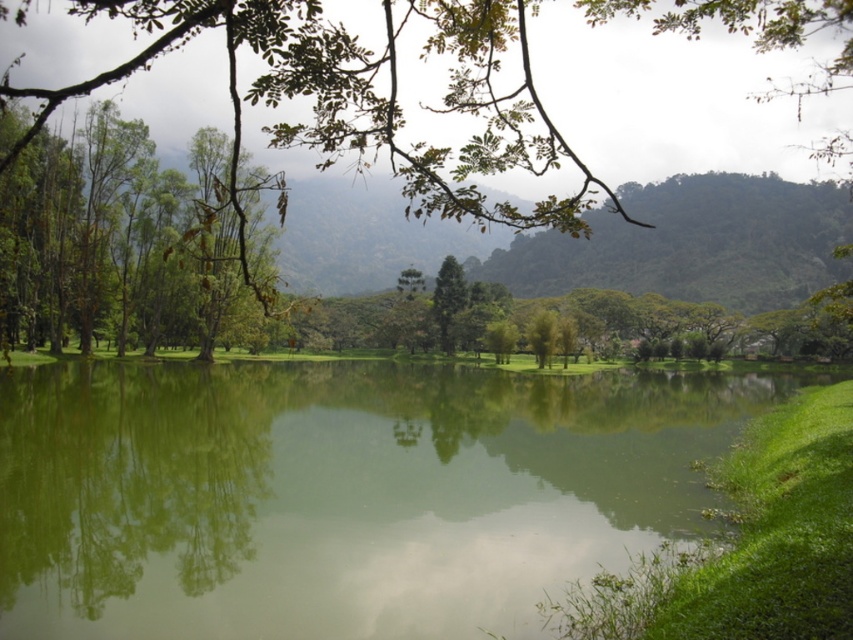
Does green leafy tree at center appear over green leafy tree at upper left?

Yes, green leafy tree at center is above green leafy tree at upper left.

Is green leafy tree at center smaller than green leafy tree at upper left?

Actually, green leafy tree at center might be larger than green leafy tree at upper left.

Between point (230, 99) and point (126, 252), which one is positioned behind?

Positioned behind is point (230, 99).

Image resolution: width=853 pixels, height=640 pixels. I want to click on green leafy tree at center, so click(367, 99).

At what (x,y) coordinates should I click in order to perform the action: click on green smooth water at center. Please return your answer as a coordinate pair (x, y). This screenshot has width=853, height=640. Looking at the image, I should click on pos(341,492).

Can you confirm if green smooth water at center is taller than green leafy tree at upper left?

Incorrect, green smooth water at center's height is not larger of green leafy tree at upper left's.

Between point (258, 432) and point (129, 268), which one is positioned behind?

The point (129, 268) is more distant.

Find the location of a particular element. The height and width of the screenshot is (640, 853). green smooth water at center is located at coordinates (341, 492).

In the scene shown: Who is taller, green smooth water at center or green leafy tree at center?

green leafy tree at center is taller.

Identify the location of green smooth water at center. (341, 492).